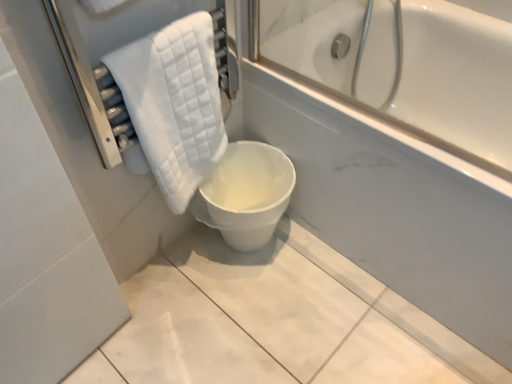
Question: Considering the positions of white glossy toilet at center and white quilted towel at left in the image, is white glossy toilet at center taller or shorter than white quilted towel at left?

Choices:
 (A) short
 (B) tall

Answer: (A)

Question: From the image's perspective, is white glossy toilet at center located above or below white quilted towel at left?

Choices:
 (A) below
 (B) above

Answer: (A)

Question: Considering the positions of white glossy toilet at center and white quilted towel at left in the image, is white glossy toilet at center bigger or smaller than white quilted towel at left?

Choices:
 (A) small
 (B) big

Answer: (B)

Question: From a real-world perspective, is white quilted towel at left positioned above or below white glossy toilet at center?

Choices:
 (A) above
 (B) below

Answer: (A)

Question: From the image's perspective, is white quilted towel at left positioned above or below white glossy toilet at center?

Choices:
 (A) above
 (B) below

Answer: (A)

Question: Considering the positions of white quilted towel at left and white glossy toilet at center in the image, is white quilted towel at left bigger or smaller than white glossy toilet at center?

Choices:
 (A) small
 (B) big

Answer: (A)

Question: Is white quilted towel at left in front of or behind white glossy toilet at center in the image?

Choices:
 (A) behind
 (B) front

Answer: (B)